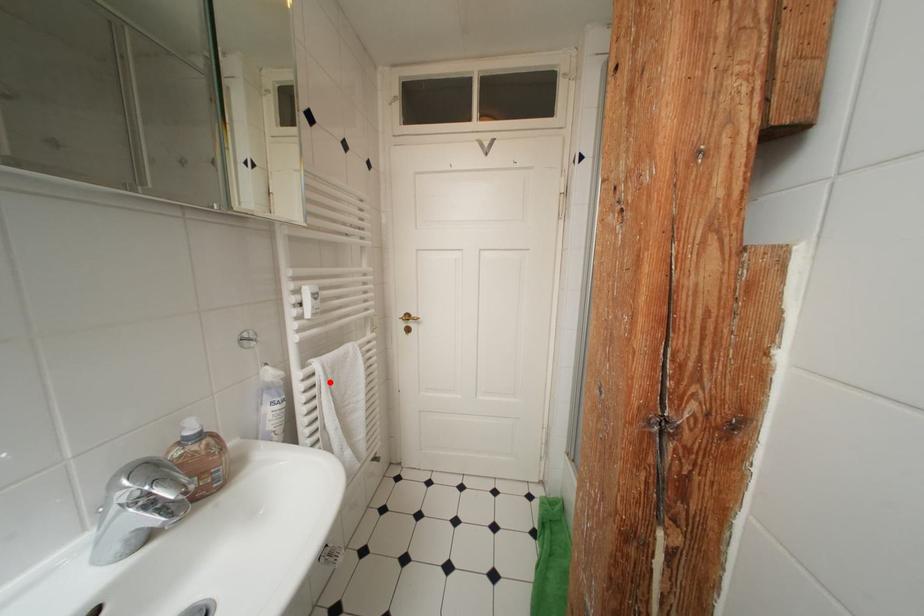
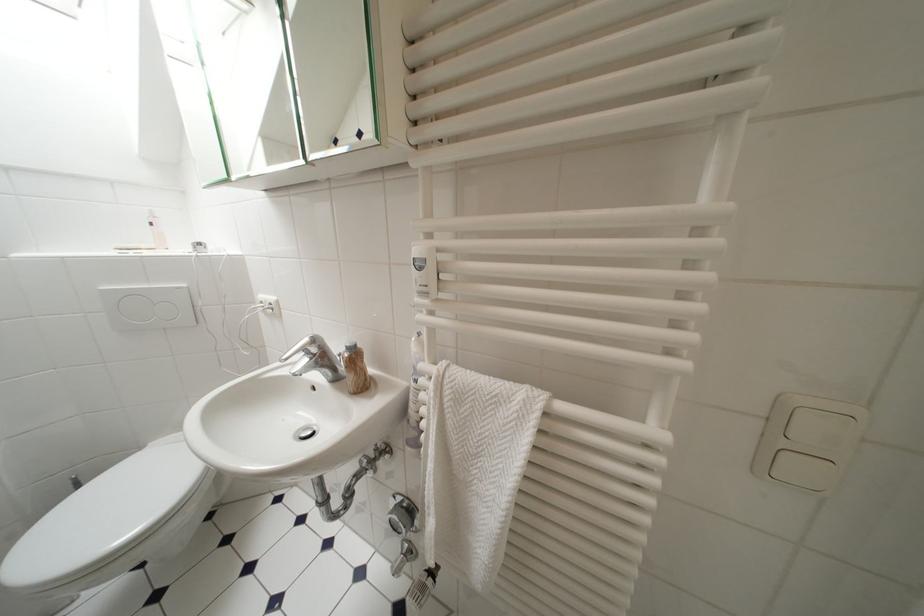
In the second image, find the point that corresponds to the highlighted location in the first image.

(439, 397)